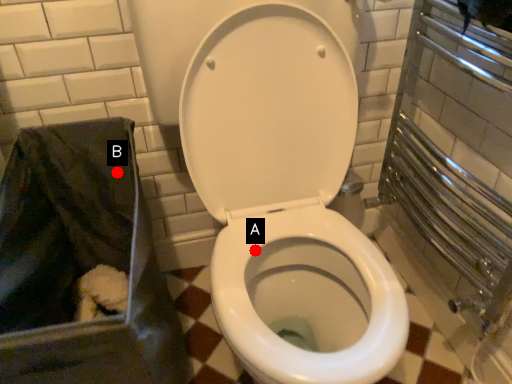
Question: Two points are circled on the image, labeled by A and B beside each circle. Which point appears closest to the camera in this image?

Choices:
 (A) A is closer
 (B) B is closer

Answer: (A)